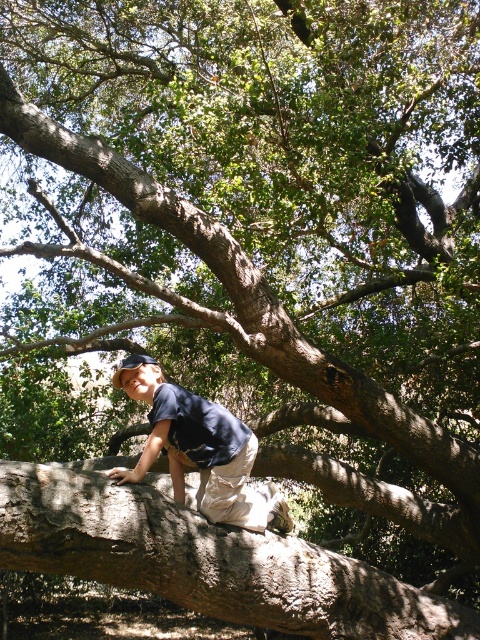
Question: Which object is closer to the camera taking this photo?

Choices:
 (A) brown rough tree trunk at center
 (B) dark blue shirt at center

Answer: (A)

Question: Can you confirm if brown rough tree trunk at center is positioned below dark blue shirt at center?

Choices:
 (A) yes
 (B) no

Answer: (A)

Question: Which of the following is the farthest from the observer?

Choices:
 (A) (227, 417)
 (B) (319, 612)

Answer: (A)

Question: Does brown rough tree trunk at center have a larger size compared to dark blue shirt at center?

Choices:
 (A) no
 (B) yes

Answer: (B)

Question: Is brown rough tree trunk at center behind dark blue shirt at center?

Choices:
 (A) yes
 (B) no

Answer: (B)